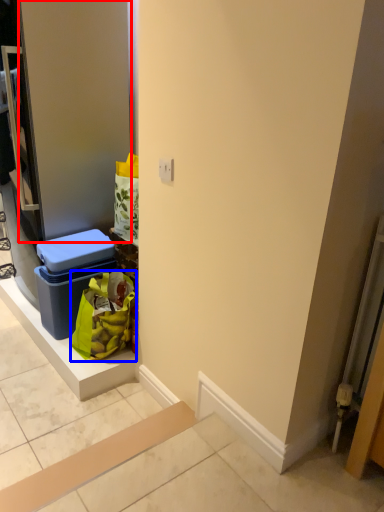
Question: Which of the following is the closest to the observer, door (highlighted by a red box) or shopping bag (highlighted by a blue box)?

Choices:
 (A) door
 (B) shopping bag

Answer: (A)